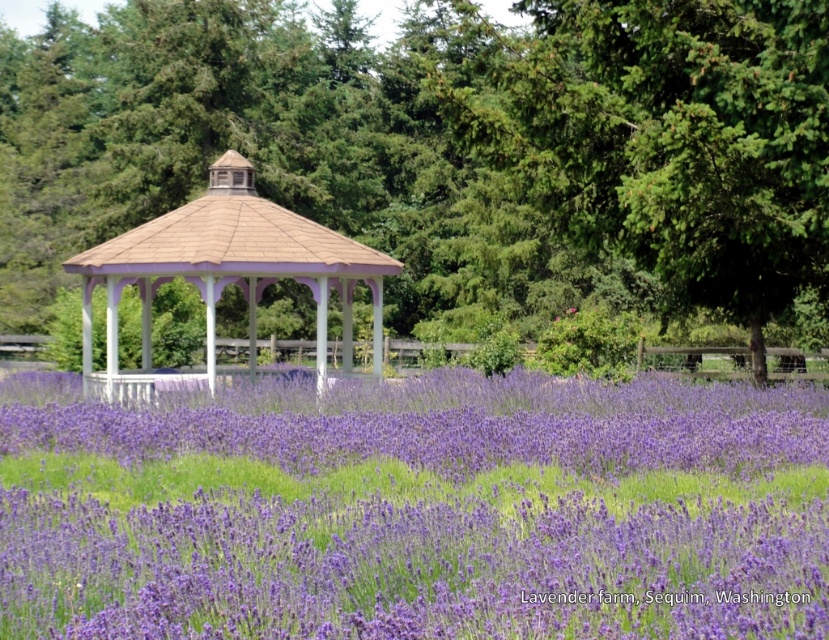
Question: Among these objects, which one is nearest to the camera?

Choices:
 (A) green leafy tree at center
 (B) matte white gazebo at center

Answer: (A)

Question: Among these points, which one is nearest to the camera?

Choices:
 (A) (153, 586)
 (B) (810, 12)

Answer: (A)

Question: Does green leafy tree at center appear on the left side of purple soft lavender at center?

Choices:
 (A) yes
 (B) no

Answer: (A)

Question: Is purple soft lavender at center to the left of matte white gazebo at center from the viewer's perspective?

Choices:
 (A) yes
 (B) no

Answer: (B)

Question: Can you confirm if purple soft lavender at center is positioned below matte white gazebo at center?

Choices:
 (A) yes
 (B) no

Answer: (A)

Question: Which of the following is the farthest from the observer?

Choices:
 (A) purple soft lavender at center
 (B) matte white gazebo at center

Answer: (B)